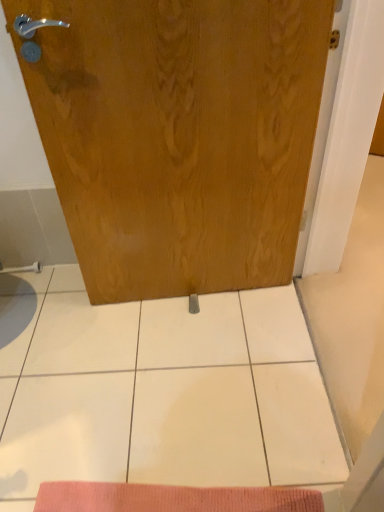
What do you see at coordinates (179, 136) in the screenshot? This screenshot has height=512, width=384. I see `wooden door at center` at bounding box center [179, 136].

Identify the location of wooden door at center. The width and height of the screenshot is (384, 512). (179, 136).

What are the coordinates of `wooden door at center` in the screenshot? It's located at (x=179, y=136).